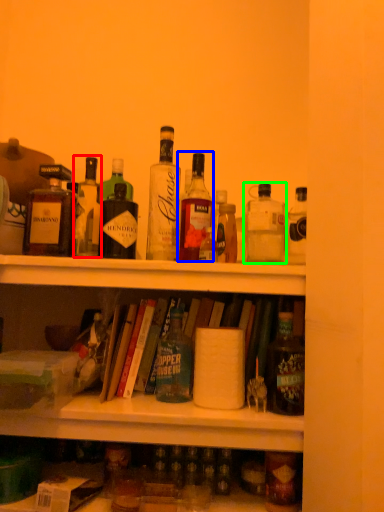
Question: Estimate the real-world distances between objects in this image. Which object is farther from bottle (highlighted by a red box), bottle (highlighted by a blue box) or bottle (highlighted by a green box)?

Choices:
 (A) bottle
 (B) bottle

Answer: (B)